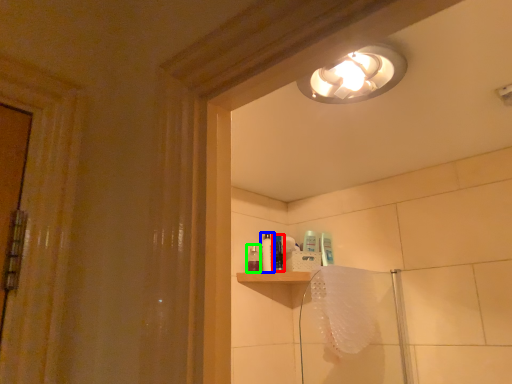
Question: Estimate the real-world distances between objects in this image. Which object is closer to toiletry (highlighted by a red box), toiletry (highlighted by a blue box) or toiletry (highlighted by a green box)?

Choices:
 (A) toiletry
 (B) toiletry

Answer: (A)